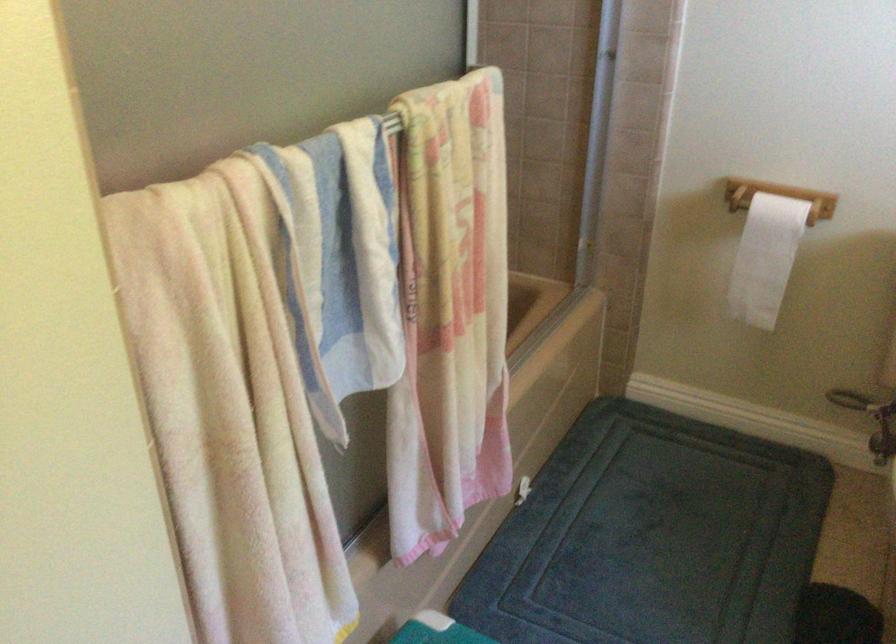
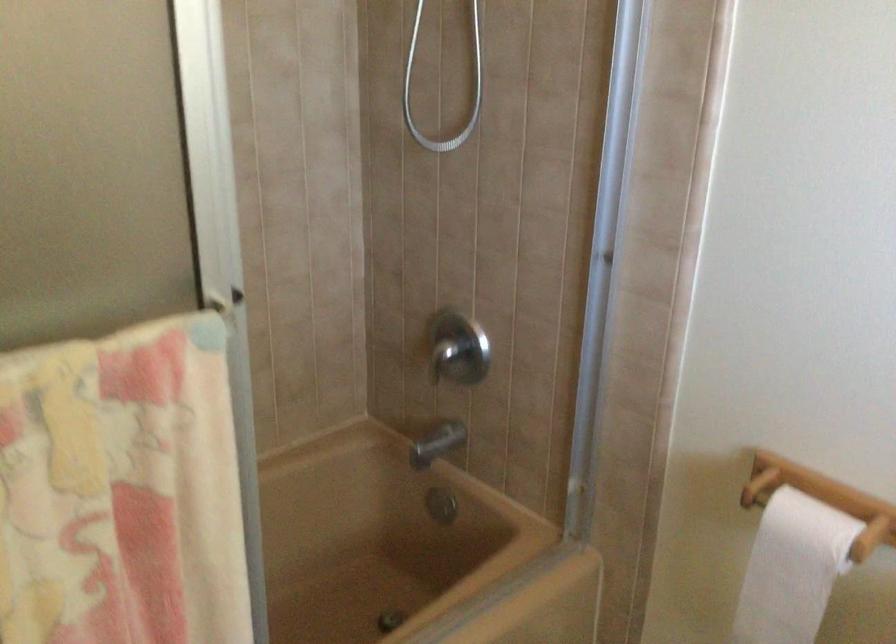
Question: The camera is either moving clockwise (left) or counter-clockwise (right) around the object. The first image is from the beginning of the video and the second image is from the end. Is the camera moving left or right when shooting the video?

Choices:
 (A) Left
 (B) Right

Answer: (B)